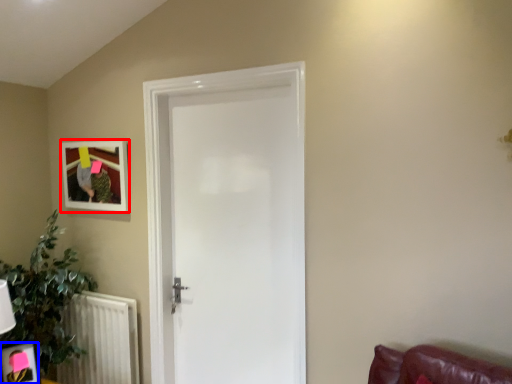
Question: Which of the following is the farthest to the observer, picture frame (highlighted by a red box) or picture frame (highlighted by a blue box)?

Choices:
 (A) picture frame
 (B) picture frame

Answer: (A)